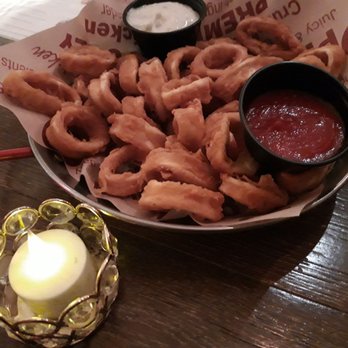
This screenshot has height=348, width=348. In order to click on table in this screenshot , I will do `click(216, 318)`.